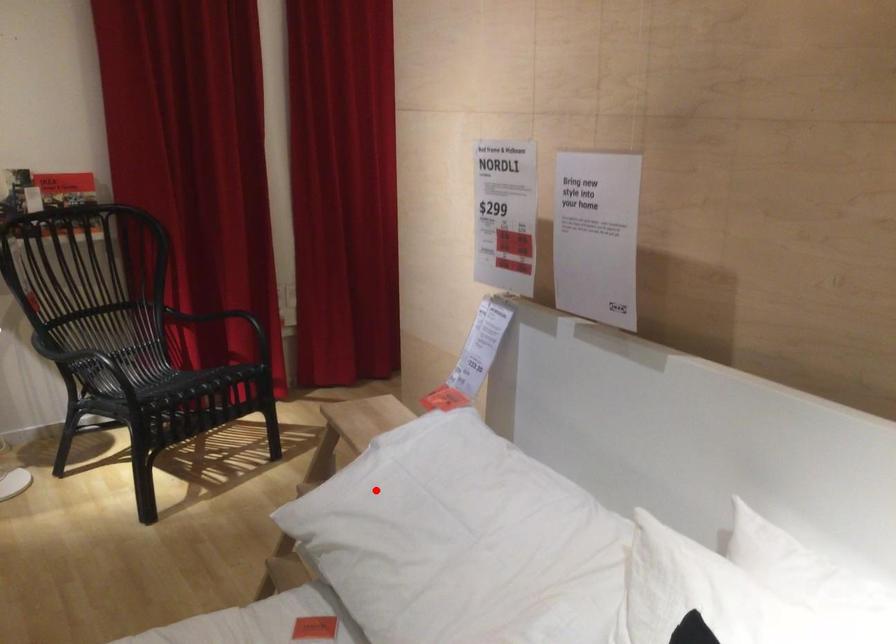
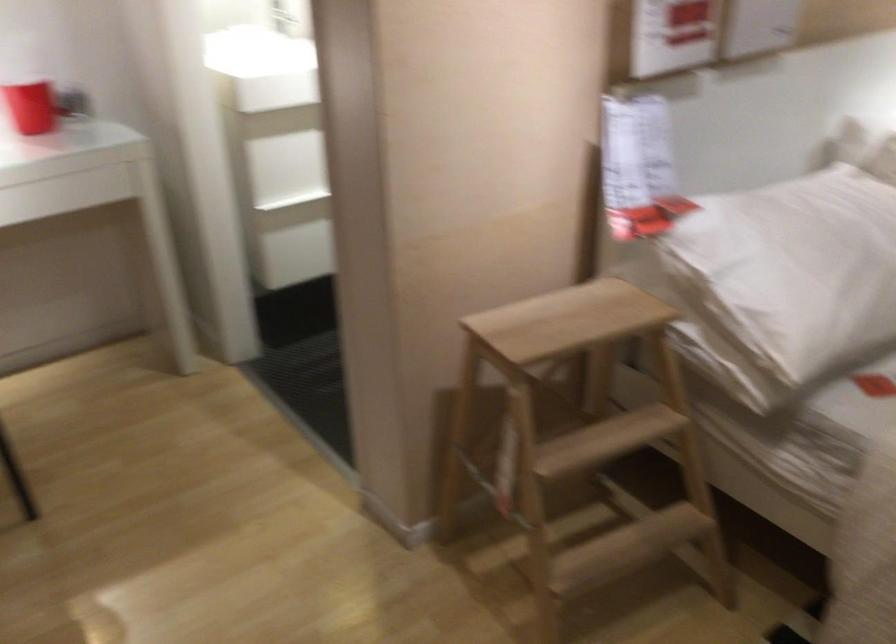
In the second image, find the point that corresponds to the highlighted location in the first image.

(785, 281)